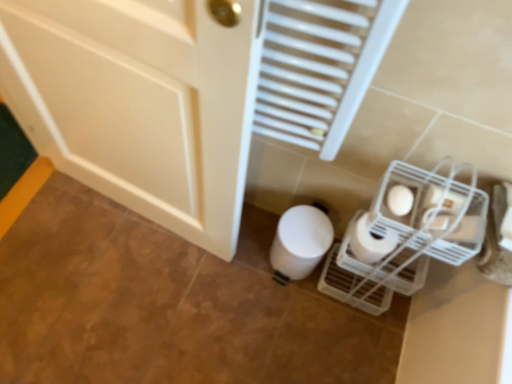
In order to face white matte toilet paper at lower right, the first toilet paper in the front-to-back sequence, should I rotate leftwards or rightwards?

A 19.231 degree turn to the right will do.

The height and width of the screenshot is (384, 512). What do you see at coordinates (320, 67) in the screenshot?
I see `white plastic radiator at upper center` at bounding box center [320, 67].

What do you see at coordinates (370, 242) in the screenshot? I see `white matte toilet paper at lower right, which appears as the second toilet paper when viewed from the back` at bounding box center [370, 242].

Measure the distance between point (353, 241) and camera.

Point (353, 241) and camera are 1.14 meters apart from each other.

This screenshot has width=512, height=384. Find the location of `white matte toilet paper at lower right, the third toilet paper positioned from the back`. white matte toilet paper at lower right, the third toilet paper positioned from the back is located at coordinates (400, 200).

From the white matte toilet paper at lower center, the third toilet paper from the front, count 1st toilet paper to the right and point to it. Please provide its 2D coordinates.

[(370, 242)]

Are white matte toilet paper at lower center, the third toilet paper from the front, and white matte toilet paper at lower right, which appears as the second toilet paper when viewed from the back, beside each other?

white matte toilet paper at lower center, the third toilet paper from the front, and white matte toilet paper at lower right, which appears as the second toilet paper when viewed from the back, are not in contact.

From the image's perspective, is white matte toilet paper at lower center, the third toilet paper from the front, above white matte toilet paper at lower right, which appears as the second toilet paper when viewed from the back?

No.

Can you confirm if white matte toilet paper at lower center, the first toilet paper from the back, is smaller than white matte toilet paper at lower right, which is the 2th toilet paper in front-to-back order?

Incorrect, white matte toilet paper at lower center, the first toilet paper from the back, is not smaller in size than white matte toilet paper at lower right, which is the 2th toilet paper in front-to-back order.

Is white matte toilet paper at lower right, which appears as the second toilet paper when viewed from the back, wider than white matte toilet paper at lower right, the third toilet paper positioned from the back?

Correct, the width of white matte toilet paper at lower right, which appears as the second toilet paper when viewed from the back, exceeds that of white matte toilet paper at lower right, the third toilet paper positioned from the back.

Considering the points (387, 234) and (394, 204), which point is behind, point (387, 234) or point (394, 204)?

The point (394, 204) is farther.

Considering the sizes of objects white matte toilet paper at lower right, which is the 2th toilet paper in front-to-back order, and white matte toilet paper at lower right, the first toilet paper in the front-to-back sequence, in the image provided, who is smaller, white matte toilet paper at lower right, which is the 2th toilet paper in front-to-back order, or white matte toilet paper at lower right, the first toilet paper in the front-to-back sequence,?

white matte toilet paper at lower right, the first toilet paper in the front-to-back sequence, is smaller.

From their relative heights in the image, would you say white matte toilet paper at lower right, which appears as the second toilet paper when viewed from the back, is taller or shorter than white matte toilet paper at lower right, the first toilet paper in the front-to-back sequence?

white matte toilet paper at lower right, which appears as the second toilet paper when viewed from the back, is taller than white matte toilet paper at lower right, the first toilet paper in the front-to-back sequence.

Locate an element on the screen. radiator in front of the white matte toilet paper at lower center, the third toilet paper from the front is located at coordinates (320, 67).

Between white plastic radiator at upper center and white matte toilet paper at lower center, the first toilet paper from the back, which one appears on the left side from the viewer's perspective?

white plastic radiator at upper center is more to the left.

Is white plastic radiator at upper center bigger or smaller than white matte toilet paper at lower center, the first toilet paper from the back?

In the image, white plastic radiator at upper center appears to be larger than white matte toilet paper at lower center, the first toilet paper from the back.

Can you confirm if white plastic radiator at upper center is wider than white matte toilet paper at lower center, the third toilet paper from the front?

No.

Looking at this image, is white matte toilet paper at lower right, which is the 2th toilet paper in front-to-back order, touching white plastic radiator at upper center?

No, white matte toilet paper at lower right, which is the 2th toilet paper in front-to-back order, is not next to white plastic radiator at upper center.

From a real-world perspective, is white matte toilet paper at lower right, which is the 2th toilet paper in front-to-back order, on white plastic radiator at upper center?

Actually, white matte toilet paper at lower right, which is the 2th toilet paper in front-to-back order, is physically below white plastic radiator at upper center in the real world.

From the picture: Can you confirm if white matte toilet paper at lower right, which appears as the second toilet paper when viewed from the back, is smaller than white plastic radiator at upper center?

Yes.

Consider the image. Considering the positions of objects white matte toilet paper at lower right, which is the 2th toilet paper in front-to-back order, and white plastic radiator at upper center in the image provided, who is in front, white matte toilet paper at lower right, which is the 2th toilet paper in front-to-back order, or white plastic radiator at upper center?

white plastic radiator at upper center is in front.

Considering the relative positions of white matte toilet paper at lower right, the first toilet paper in the front-to-back sequence, and white plastic radiator at upper center in the image provided, is white matte toilet paper at lower right, the first toilet paper in the front-to-back sequence, to the right of white plastic radiator at upper center from the viewer's perspective?

Yes, white matte toilet paper at lower right, the first toilet paper in the front-to-back sequence, is to the right of white plastic radiator at upper center.

Is white matte toilet paper at lower right, the third toilet paper positioned from the back, bigger than white plastic radiator at upper center?

Incorrect, white matte toilet paper at lower right, the third toilet paper positioned from the back, is not larger than white plastic radiator at upper center.

Measure the distance between white matte toilet paper at lower right, the first toilet paper in the front-to-back sequence, and white plastic radiator at upper center.

white matte toilet paper at lower right, the first toilet paper in the front-to-back sequence, and white plastic radiator at upper center are 33.37 centimeters apart from each other.

Which of these two, white matte toilet paper at lower right, the third toilet paper positioned from the back, or white plastic radiator at upper center, is wider?

white plastic radiator at upper center is wider.

Measure the distance between white plastic radiator at upper center and white matte toilet paper at lower right, which appears as the second toilet paper when viewed from the back.

The distance of white plastic radiator at upper center from white matte toilet paper at lower right, which appears as the second toilet paper when viewed from the back, is 36.87 centimeters.

Considering the relative sizes of white plastic radiator at upper center and white matte toilet paper at lower right, which appears as the second toilet paper when viewed from the back, in the image provided, is white plastic radiator at upper center smaller than white matte toilet paper at lower right, which appears as the second toilet paper when viewed from the back,?

No, white plastic radiator at upper center is not smaller than white matte toilet paper at lower right, which appears as the second toilet paper when viewed from the back.

You are a GUI agent. You are given a task and a screenshot of the screen. Output one action in this format:
    pyautogui.click(x=<x>, y=<y>)
    Task: Click on the 2nd toilet paper behind the white plastic radiator at upper center, starting your count from the anchor
    
    Given the screenshot: What is the action you would take?
    pyautogui.click(x=370, y=242)

Based on their positions, is white plastic radiator at upper center located to the left or right of white matte toilet paper at lower right, which appears as the second toilet paper when viewed from the back?

white plastic radiator at upper center is positioned on white matte toilet paper at lower right, which appears as the second toilet paper when viewed from the back,'s left side.

Is white matte toilet paper at lower right, which is the 2th toilet paper in front-to-back order, touching white matte toilet paper at lower center, the first toilet paper from the back?

white matte toilet paper at lower right, which is the 2th toilet paper in front-to-back order, is not next to white matte toilet paper at lower center, the first toilet paper from the back, and they're not touching.

Where is `toilet paper below the white matte toilet paper at lower right, which is the 2th toilet paper in front-to-back order (from the image's perspective)`? This screenshot has width=512, height=384. toilet paper below the white matte toilet paper at lower right, which is the 2th toilet paper in front-to-back order (from the image's perspective) is located at coordinates (300, 241).

From the image's perspective, relative to white matte toilet paper at lower center, the third toilet paper from the front, is white matte toilet paper at lower right, which appears as the second toilet paper when viewed from the back, above or below?

Clearly, from the image's perspective, white matte toilet paper at lower right, which appears as the second toilet paper when viewed from the back, is above white matte toilet paper at lower center, the third toilet paper from the front.

Who is taller, white matte toilet paper at lower right, which is the 2th toilet paper in front-to-back order, or white matte toilet paper at lower center, the third toilet paper from the front?

Standing taller between the two is white matte toilet paper at lower center, the third toilet paper from the front.

Starting from the white matte toilet paper at lower center, the first toilet paper from the back, which toilet paper is the 1st one to the right? Please provide its 2D coordinates.

[(370, 242)]

In order to click on the 1st toilet paper to the left of the white matte toilet paper at lower right, the first toilet paper in the front-to-back sequence, counting from the anchor's position in this screenshot , I will do point(370,242).

Which object lies further to the anchor point white plastic radiator at upper center, white matte toilet paper at lower right, which appears as the second toilet paper when viewed from the back, or white matte toilet paper at lower center, the first toilet paper from the back?

white matte toilet paper at lower center, the first toilet paper from the back, is positioned further to the anchor white plastic radiator at upper center.

Estimate the real-world distances between objects in this image. Which object is further from white matte toilet paper at lower right, which is the 2th toilet paper in front-to-back order, white matte toilet paper at lower center, the third toilet paper from the front, or white matte toilet paper at lower right, the first toilet paper in the front-to-back sequence?

Based on the image, white matte toilet paper at lower center, the third toilet paper from the front, appears to be further to white matte toilet paper at lower right, which is the 2th toilet paper in front-to-back order.

From the image, which object appears to be farther from white matte toilet paper at lower right, the first toilet paper in the front-to-back sequence, white matte toilet paper at lower center, the third toilet paper from the front, or white plastic radiator at upper center?

white matte toilet paper at lower center, the third toilet paper from the front, is further to white matte toilet paper at lower right, the first toilet paper in the front-to-back sequence.

From the image, which object appears to be farther from white matte toilet paper at lower right, the first toilet paper in the front-to-back sequence, white plastic radiator at upper center or white matte toilet paper at lower center, the first toilet paper from the back?

Among the two, white matte toilet paper at lower center, the first toilet paper from the back, is located further to white matte toilet paper at lower right, the first toilet paper in the front-to-back sequence.

Based on their spatial positions, is white matte toilet paper at lower right, the third toilet paper positioned from the back, or white plastic radiator at upper center closer to white matte toilet paper at lower center, the third toilet paper from the front?

white matte toilet paper at lower right, the third toilet paper positioned from the back, is closer to white matte toilet paper at lower center, the third toilet paper from the front.

Considering their positions, is white plastic radiator at upper center positioned further to white matte toilet paper at lower right, which appears as the second toilet paper when viewed from the back, than white matte toilet paper at lower right, the third toilet paper positioned from the back?

white plastic radiator at upper center.

From the image, which object appears to be farther from white matte toilet paper at lower right, the first toilet paper in the front-to-back sequence, white plastic radiator at upper center or white matte toilet paper at lower right, which is the 2th toilet paper in front-to-back order?

Among the two, white plastic radiator at upper center is located further to white matte toilet paper at lower right, the first toilet paper in the front-to-back sequence.

When comparing their distances from white plastic radiator at upper center, does white matte toilet paper at lower right, the third toilet paper positioned from the back, or white matte toilet paper at lower right, which appears as the second toilet paper when viewed from the back, seem further?

white matte toilet paper at lower right, which appears as the second toilet paper when viewed from the back, is positioned further to the anchor white plastic radiator at upper center.

This screenshot has width=512, height=384. What are the coordinates of `toilet paper positioned between white plastic radiator at upper center and white matte toilet paper at lower right, which is the 2th toilet paper in front-to-back order, from near to far` in the screenshot? It's located at (400, 200).

You are a GUI agent. You are given a task and a screenshot of the screen. Output one action in this format:
    pyautogui.click(x=<x>, y=<y>)
    Task: Click on the toilet paper between white matte toilet paper at lower right, the third toilet paper positioned from the back, and white matte toilet paper at lower center, the third toilet paper from the front, along the z-axis
    The image size is (512, 384).
    Given the screenshot: What is the action you would take?
    pyautogui.click(x=370, y=242)